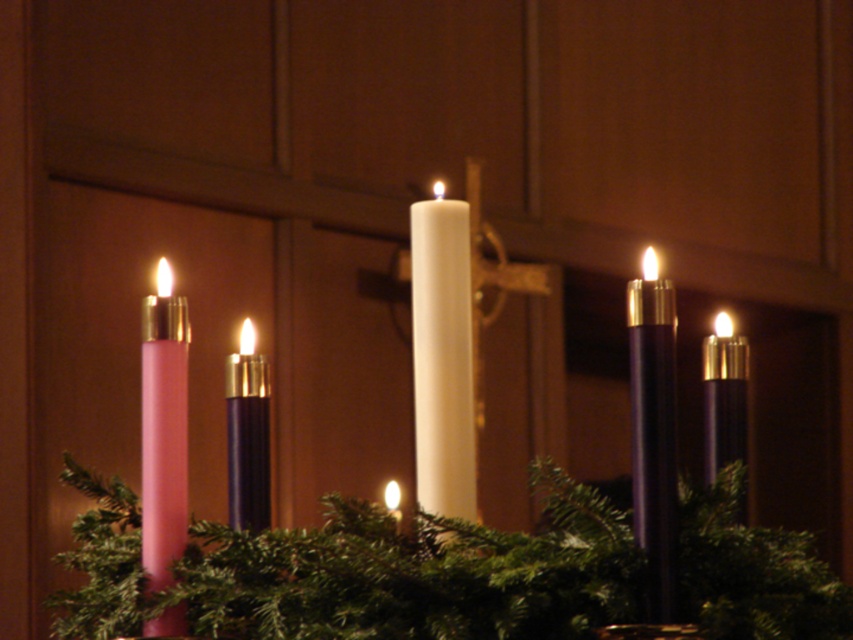
Who is taller, white matte candle at center or matte purple candle at right?

white matte candle at center is taller.

Looking at this image, is white matte candle at center above matte purple candle at right?

Correct, white matte candle at center is located above matte purple candle at right.

The width and height of the screenshot is (853, 640). I want to click on white matte candle at center, so click(442, 356).

At what (x,y) coordinates should I click in order to perform the action: click on white matte candle at center. Please return your answer as a coordinate pair (x, y). The width and height of the screenshot is (853, 640). Looking at the image, I should click on pyautogui.click(x=442, y=356).

Is point (155, 440) more distant than point (637, 522)?

Yes, point (155, 440) is behind point (637, 522).

Between pink matte candle at left and matte black candle at right, which one is positioned higher?

matte black candle at right

Measure the distance between point (178,467) and camera.

Point (178,467) and camera are 68.66 centimeters apart.

Find the location of a particular element. Image resolution: width=853 pixels, height=640 pixels. pink matte candle at left is located at coordinates (163, 428).

Between purple matte candle at center and matte purple candle at right, which one is positioned lower?

purple matte candle at center is below.

Does purple matte candle at center appear over matte purple candle at right?

Actually, purple matte candle at center is below matte purple candle at right.

Between point (225, 365) and point (730, 349), which one is positioned behind?

The point (225, 365) is more distant.

The image size is (853, 640). What are the coordinates of `purple matte candle at center` in the screenshot? It's located at (247, 435).